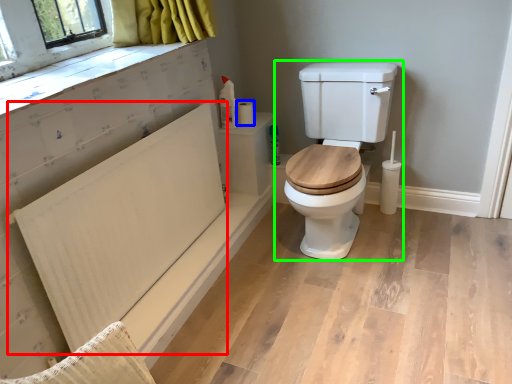
Question: Which object is positioned farthest from radiator (highlighted by a red box)? Select from toilet paper (highlighted by a blue box) and toilet (highlighted by a green box).

Choices:
 (A) toilet paper
 (B) toilet

Answer: (A)